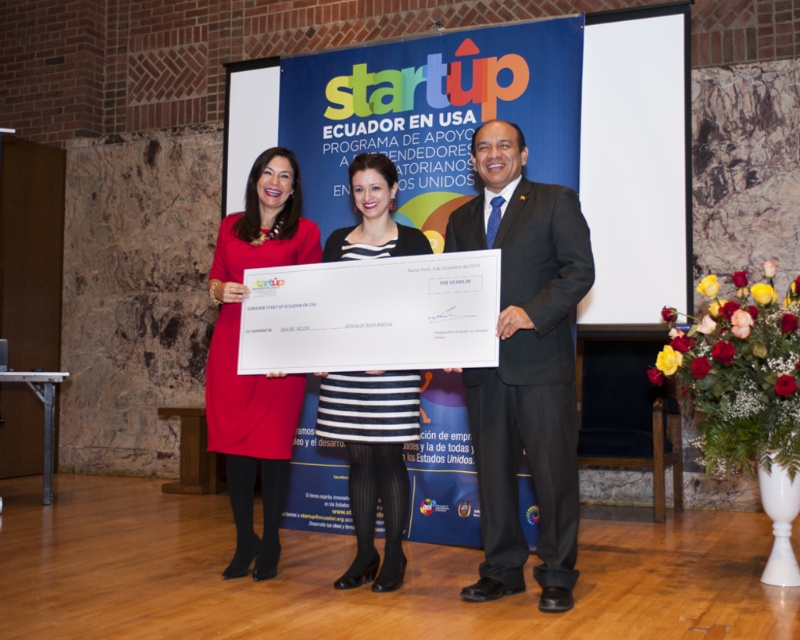
Question: Which point is closer to the camera?

Choices:
 (A) dark gray suit at center
 (B) matte red dress at center

Answer: (A)

Question: Considering the relative positions of dark gray suit at center and striped fabric dress at center in the image provided, where is dark gray suit at center located with respect to striped fabric dress at center?

Choices:
 (A) left
 (B) right

Answer: (B)

Question: Which object appears farthest from the camera in this image?

Choices:
 (A) dark gray suit at center
 (B) striped fabric dress at center

Answer: (B)

Question: Does dark gray suit at center have a smaller size compared to matte red dress at center?

Choices:
 (A) yes
 (B) no

Answer: (B)

Question: Which object is the farthest from the matte red dress at center?

Choices:
 (A) striped fabric dress at center
 (B) dark gray suit at center

Answer: (B)

Question: Is matte red dress at center thinner than striped fabric dress at center?

Choices:
 (A) no
 (B) yes

Answer: (A)